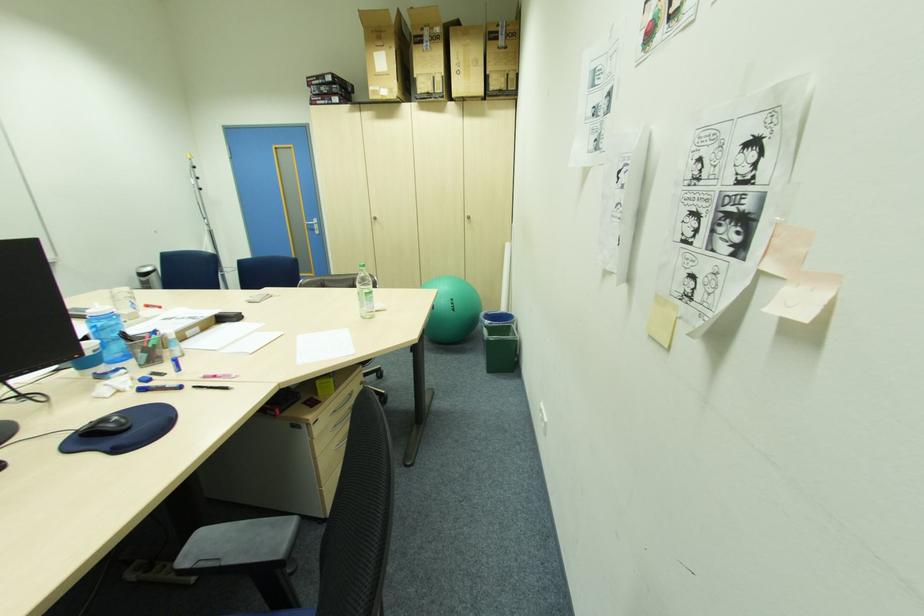
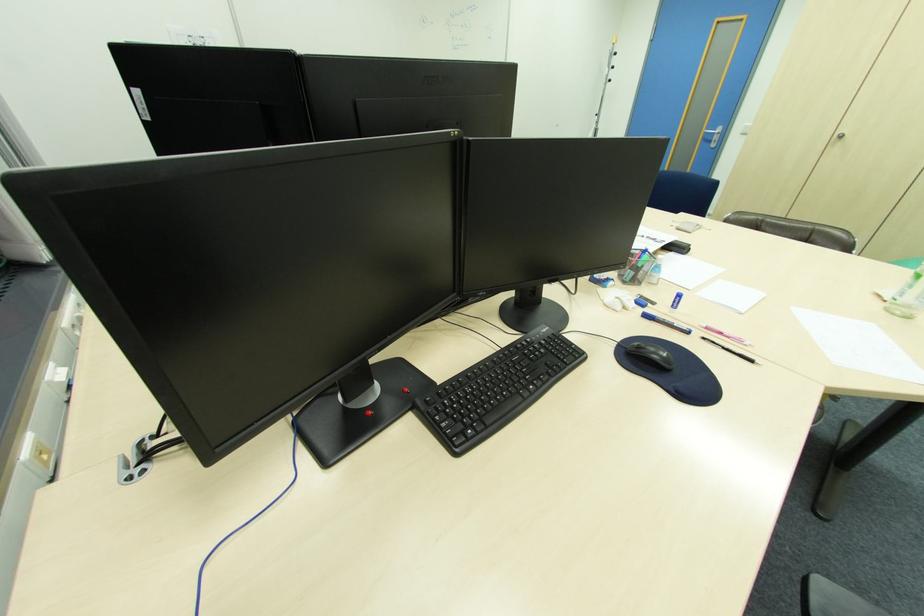
The point at (317, 228) is marked in the first image. Where is the corresponding point in the second image?

(713, 139)